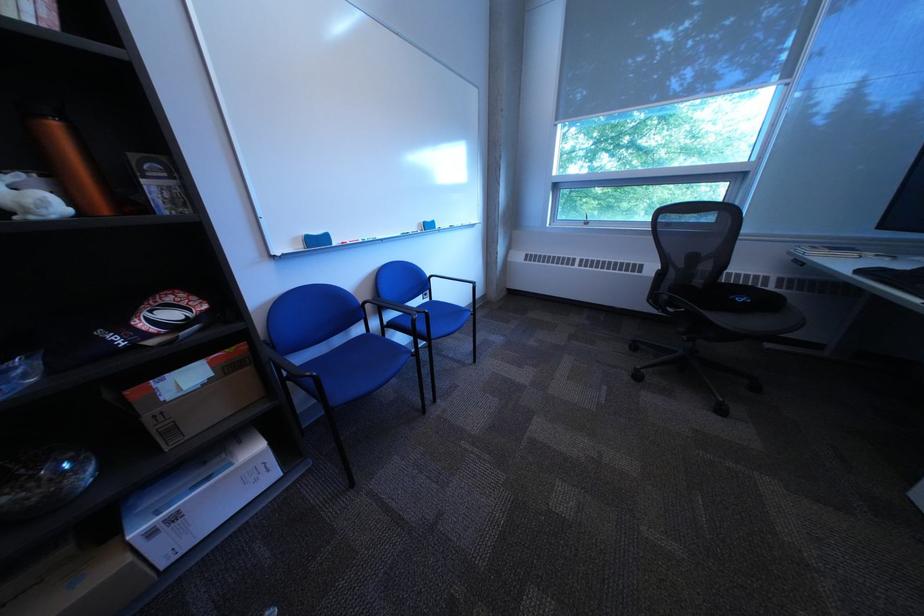
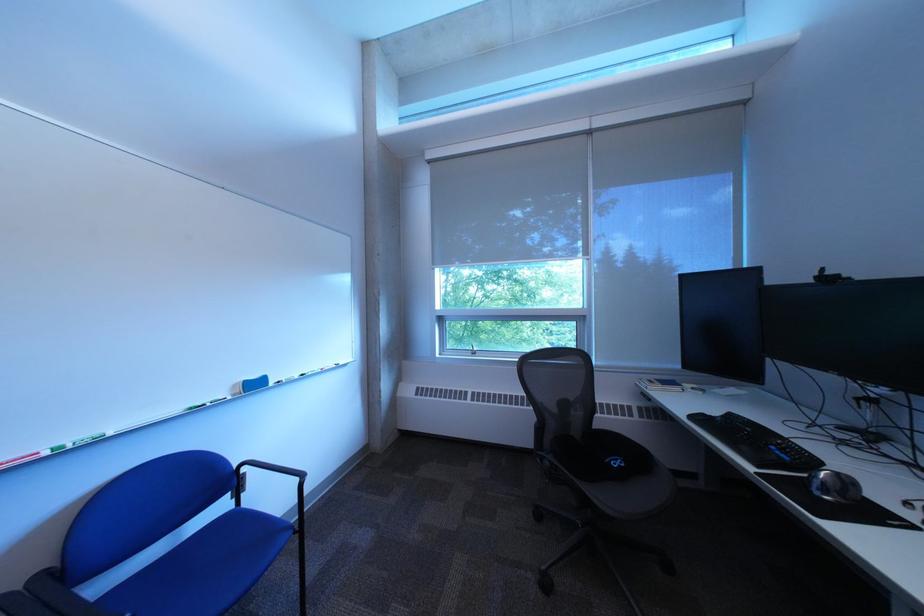
In the second image, find the point that corresponds to point (877, 274) in the first image.

(708, 419)